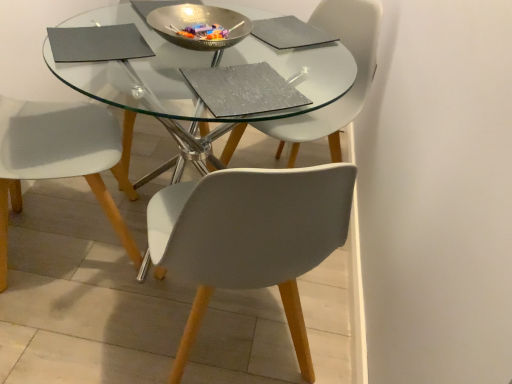
This screenshot has width=512, height=384. Identify the location of free spot below white matte chair at lower left, which is the second chair in right-to-left order (from a real-world perspective). (46, 236).